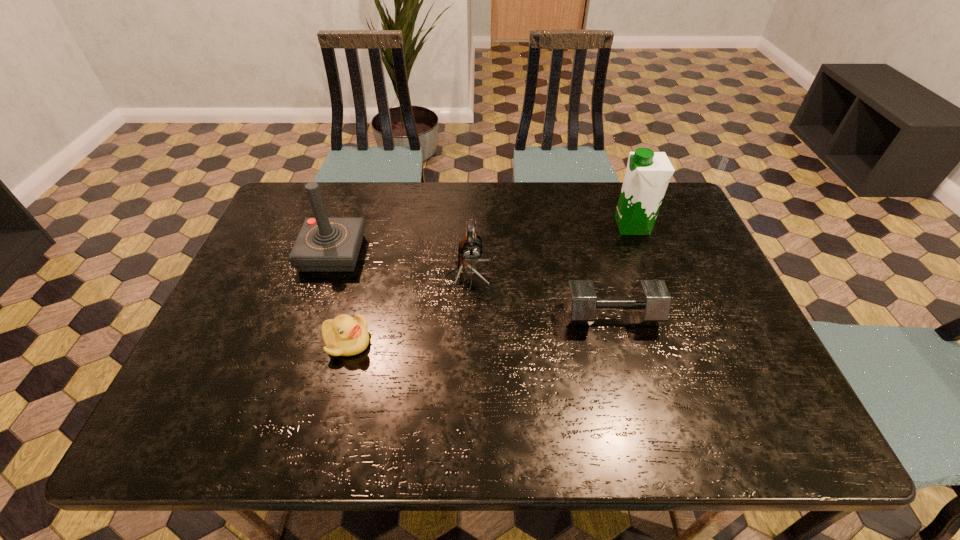
Locate an element on the screen. The image size is (960, 540). vacant position at the right edge of the desktop is located at coordinates (679, 330).

In the image, there is a desktop. At what (x,y) coordinates should I click in order to perform the action: click on vacant space at the far left corner. Please return your answer as a coordinate pair (x, y). The height and width of the screenshot is (540, 960). Looking at the image, I should click on (283, 198).

The height and width of the screenshot is (540, 960). In order to click on vacant area between the dumbbell and the joystick in this screenshot , I will do 471,285.

Locate an element on the screen. vacant area that lies between the soya milk and the dumbbell is located at coordinates (621, 271).

You are a GUI agent. You are given a task and a screenshot of the screen. Output one action in this format:
    pyautogui.click(x=<x>, y=<y>)
    Task: Click on the vacant area that lies between the earphone and the joystick
    
    Given the screenshot: What is the action you would take?
    pyautogui.click(x=400, y=265)

You are a GUI agent. You are given a task and a screenshot of the screen. Output one action in this format:
    pyautogui.click(x=<x>, y=<y>)
    Task: Click on the vacant region between the joystick and the third object from left to right
    Image resolution: width=960 pixels, height=540 pixels.
    Given the screenshot: What is the action you would take?
    pyautogui.click(x=400, y=265)

At what (x,y) coordinates should I click in order to perform the action: click on unoccupied area between the dumbbell and the joystick. Please return your answer as a coordinate pair (x, y). Looking at the image, I should click on (471, 285).

Identify the location of free space between the third shortest object and the soya milk. Image resolution: width=960 pixels, height=540 pixels. (550, 251).

This screenshot has height=540, width=960. Find the location of `vacant area that lies between the duckling and the dumbbell`. vacant area that lies between the duckling and the dumbbell is located at coordinates (479, 329).

You are a GUI agent. You are given a task and a screenshot of the screen. Output one action in this format:
    pyautogui.click(x=<x>, y=<y>)
    Task: Click on the vacant space in between the dumbbell and the soya milk
    
    Given the screenshot: What is the action you would take?
    [x=621, y=271]